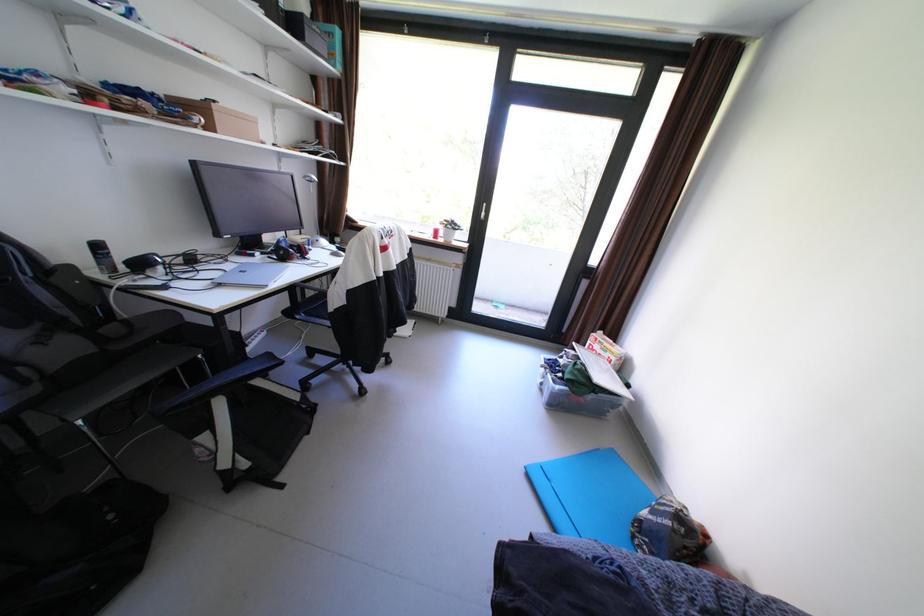
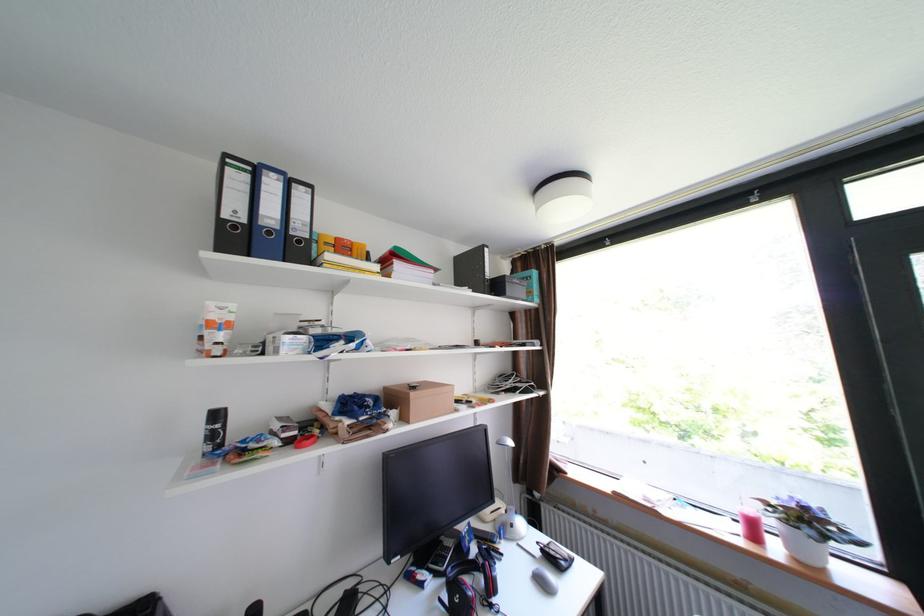
In the scene shown: First-person continuous shooting, in which direction is the camera rotating?

The camera's rotation is toward left-up.